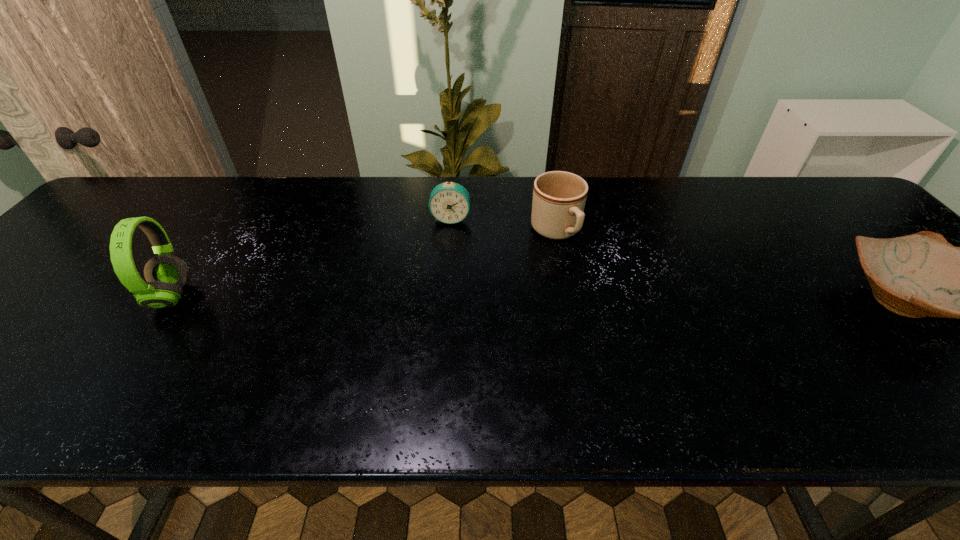
I want to click on blank space located 0.100m on the front-facing side of the alarm clock, so click(x=445, y=250).

At what (x,y) coordinates should I click in order to perform the action: click on mug that is at the far edge. Please return your answer as a coordinate pair (x, y). This screenshot has width=960, height=540. Looking at the image, I should click on (559, 197).

In order to click on alarm clock that is at the far edge in this screenshot , I will do `click(449, 202)`.

The width and height of the screenshot is (960, 540). Identify the location of vacant space at the far edge of the desktop. (663, 180).

The width and height of the screenshot is (960, 540). I want to click on vacant area at the near edge of the desktop, so click(682, 353).

Image resolution: width=960 pixels, height=540 pixels. Find the location of `vacant space at the left edge of the desktop`. vacant space at the left edge of the desktop is located at coordinates (63, 258).

Find the location of a particular element. vacant area between the alarm clock and the second object from right to left is located at coordinates (503, 225).

You are a GUI agent. You are given a task and a screenshot of the screen. Output one action in this format:
    pyautogui.click(x=<x>, y=<y>)
    Task: Click on the unoccupied area between the alarm clock and the tallest object
    
    Given the screenshot: What is the action you would take?
    pyautogui.click(x=311, y=258)

What are the coordinates of `vacant area that lies between the headset and the alarm clock` in the screenshot? It's located at (311, 258).

Identify which object is the nearest to the leftmost object. Please provide its 2D coordinates. Your answer should be formatted as a tuple, i.e. [(x, y)], where the tuple contains the x and y coordinates of a point satisfying the conditions above.

[(449, 202)]